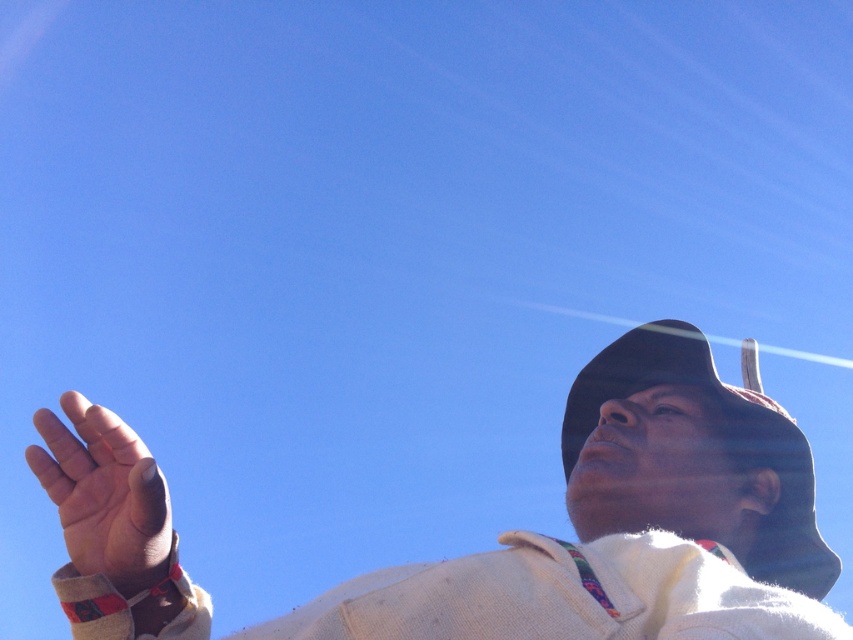
From the picture: You are a photographer trying to capture a closeup of the smooth skin hand at lower left without the brown felt cowboy hat at right appearing in the frame. Can you adjust your camera angle to achieve this?

The brown felt cowboy hat at right is to the right of the smooth skin hand at lower left, so if you move the camera to the left side of the hand, you can avoid including the hat in the shot.

Looking at this image, you are a photographer trying to capture the scene. You notice the brown felt cowboy hat at right and the smooth skin hand at lower left. Which object would appear bigger in your photo?

The brown felt cowboy hat at right appears bigger in the photo because it is larger in size than the smooth skin hand at lower left.

You are a photographer trying to capture a closeup of the white knitted sweater at upper right and the brown felt cowboy hat at right in the image. Given that your camera can only focus on objects within a 10 inch range, will both items be in focus?

The white knitted sweater at upper right and brown felt cowboy hat at right are 11.48 inches apart from each other. Since the distance between them exceeds the camera focus range of 10 inches, both items cannot be in focus simultaneously.